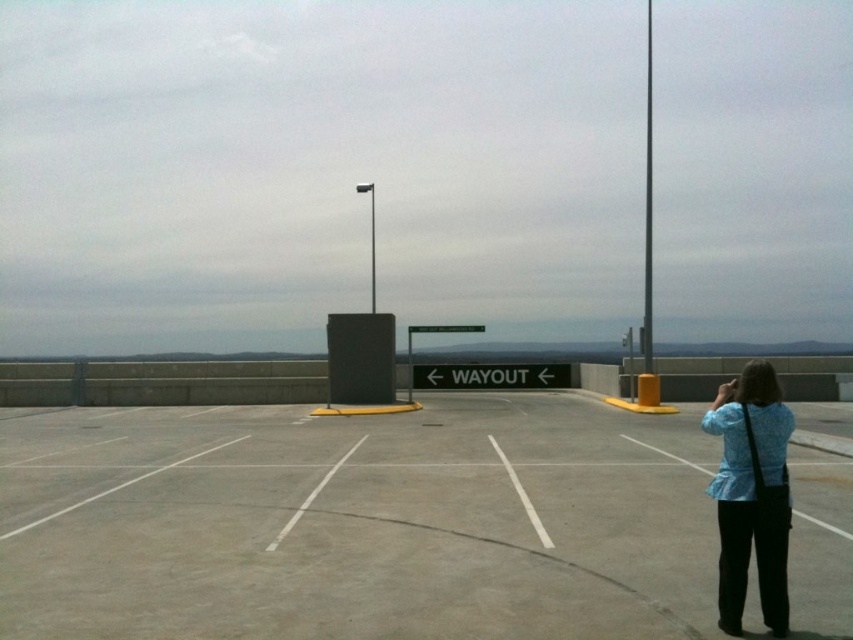
Question: Which object appears closest to the camera in this image?

Choices:
 (A) gray concrete parking lot at center
 (B) blue fabric shirt at right

Answer: (B)

Question: Which point is farther from the camera taking this photo?

Choices:
 (A) (683, 486)
 (B) (718, 513)

Answer: (A)

Question: Can you confirm if gray concrete parking lot at center is positioned to the right of blue fabric shirt at right?

Choices:
 (A) no
 (B) yes

Answer: (A)

Question: Which of the following is the farthest from the observer?

Choices:
 (A) blue fabric shirt at right
 (B) gray concrete parking lot at center

Answer: (B)

Question: Can you confirm if gray concrete parking lot at center is bigger than blue fabric shirt at right?

Choices:
 (A) no
 (B) yes

Answer: (A)

Question: Is the position of gray concrete parking lot at center less distant than that of blue fabric shirt at right?

Choices:
 (A) yes
 (B) no

Answer: (B)